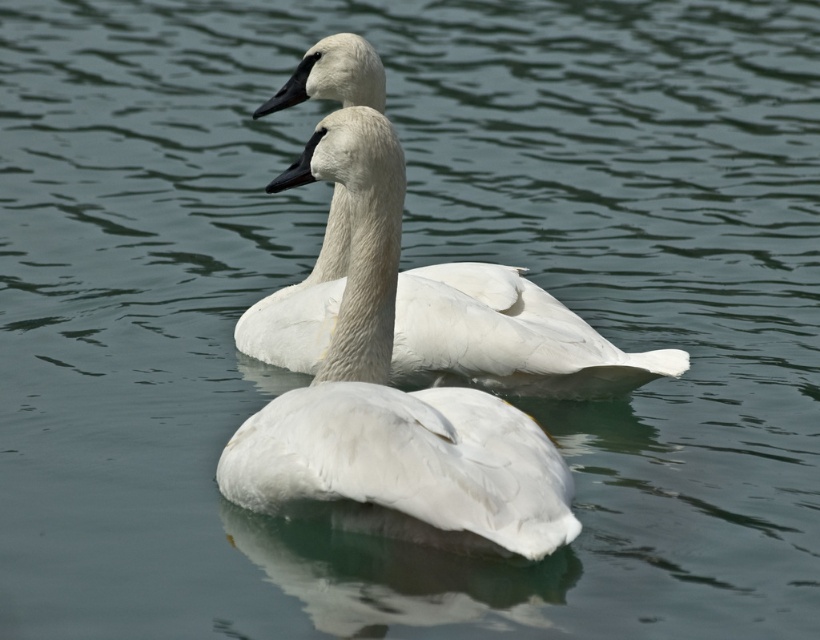
Question: Which point is farther to the camera?

Choices:
 (A) white feathered swan at center
 (B) white matte swan at center

Answer: (B)

Question: Is white feathered swan at center positioned at the back of white matte swan at center?

Choices:
 (A) no
 (B) yes

Answer: (A)

Question: Is white feathered swan at center above white matte swan at center?

Choices:
 (A) no
 (B) yes

Answer: (A)

Question: Which object is farther from the camera taking this photo?

Choices:
 (A) white feathered swan at center
 (B) white matte swan at center

Answer: (B)

Question: Does white feathered swan at center come behind white matte swan at center?

Choices:
 (A) no
 (B) yes

Answer: (A)